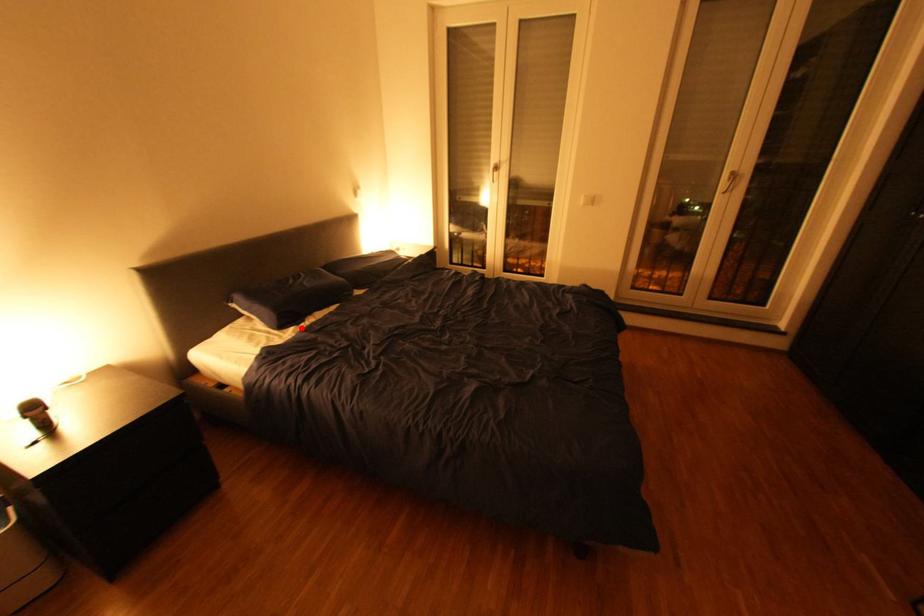
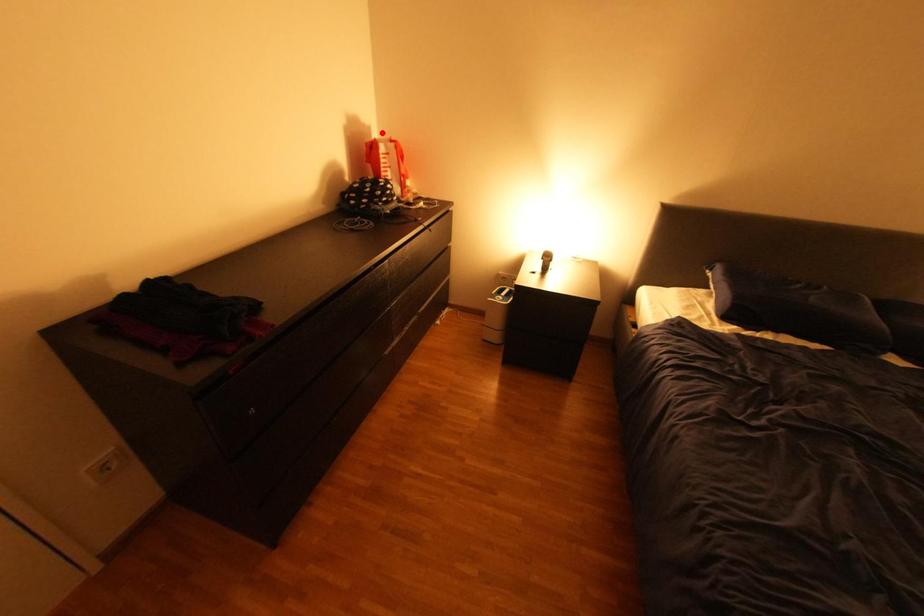
I am providing you with two images of the same scene from different viewpoints. A red point is marked on the first image and another point is marked on the second image. Do the highlighted points in image1 and image2 indicate the same real-world spot?

No